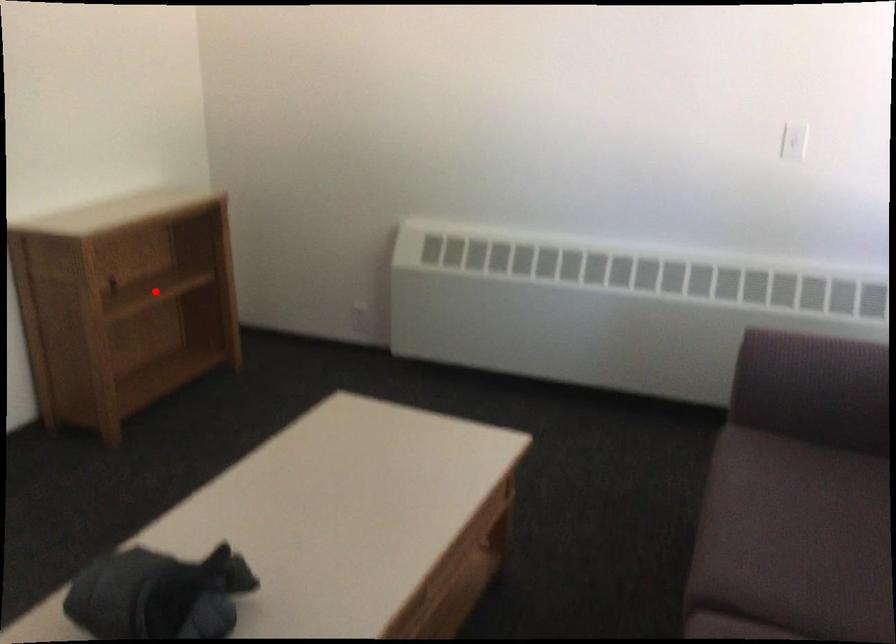
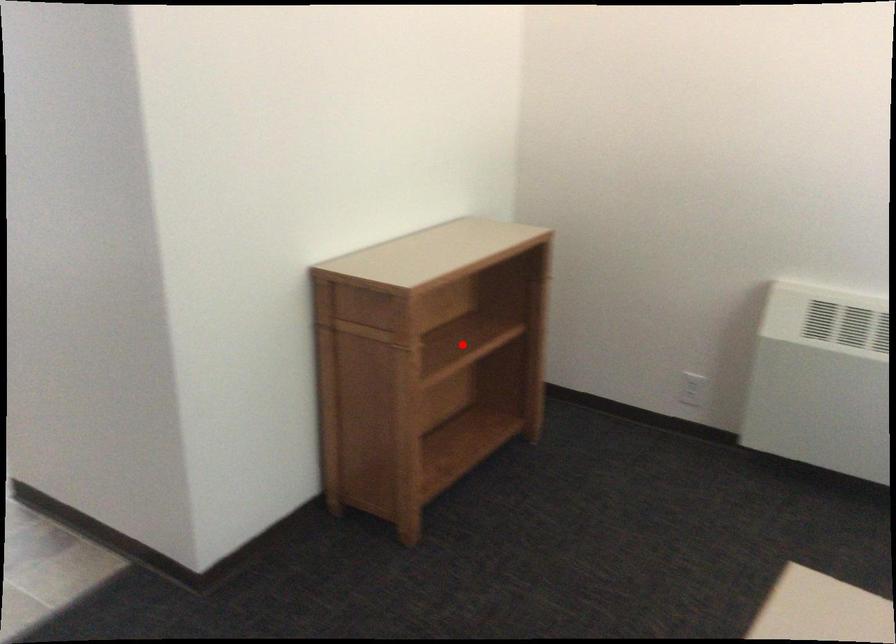
I am providing you with two images of the same scene from different viewpoints. A red point is marked on the first image and another point is marked on the second image. Are the points marked in image1 and image2 representing the same 3D position?

Yes